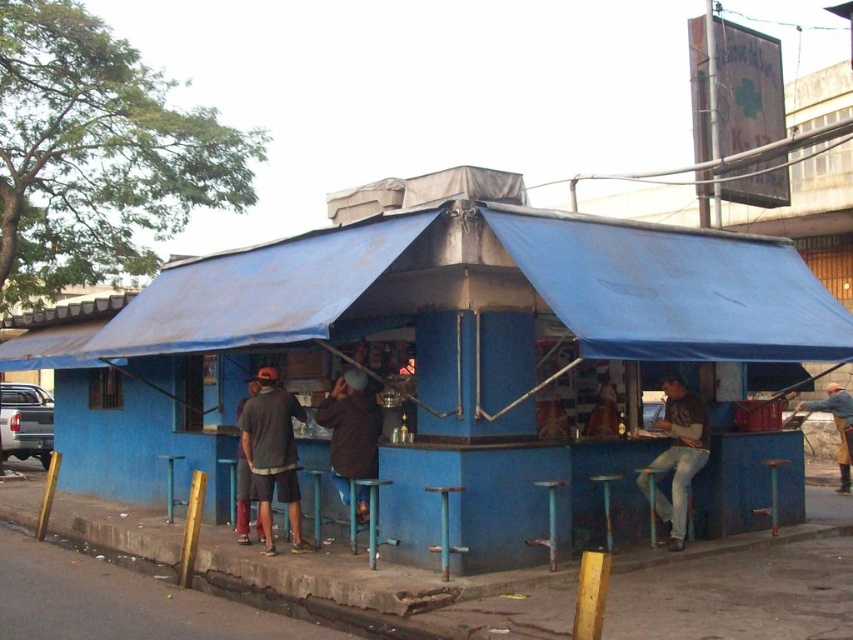
Question: Is denim jacket at lower right closer to camera compared to blue plastic stool at lower center?

Choices:
 (A) yes
 (B) no

Answer: (B)

Question: Which point is farther to the camera?

Choices:
 (A) (459, 552)
 (B) (251, 468)
 (C) (556, 541)
 (D) (646, 483)

Answer: (D)

Question: Is blue painted structure at center closer to camera compared to denim jacket at lower right?

Choices:
 (A) yes
 (B) no

Answer: (A)

Question: Which point is farther to the camera?

Choices:
 (A) blue painted structure at center
 (B) dark gray t-shirt at center
 (C) blue plastic stool at lower center

Answer: (B)

Question: Estimate the real-world distances between objects in this image. Which object is farther from the blue painted structure at center?

Choices:
 (A) denim jacket at lower right
 (B) brown matte jacket at center

Answer: (A)

Question: From the image, what is the correct spatial relationship of blue painted structure at center in relation to wooden stool at lower center?

Choices:
 (A) below
 (B) above

Answer: (B)